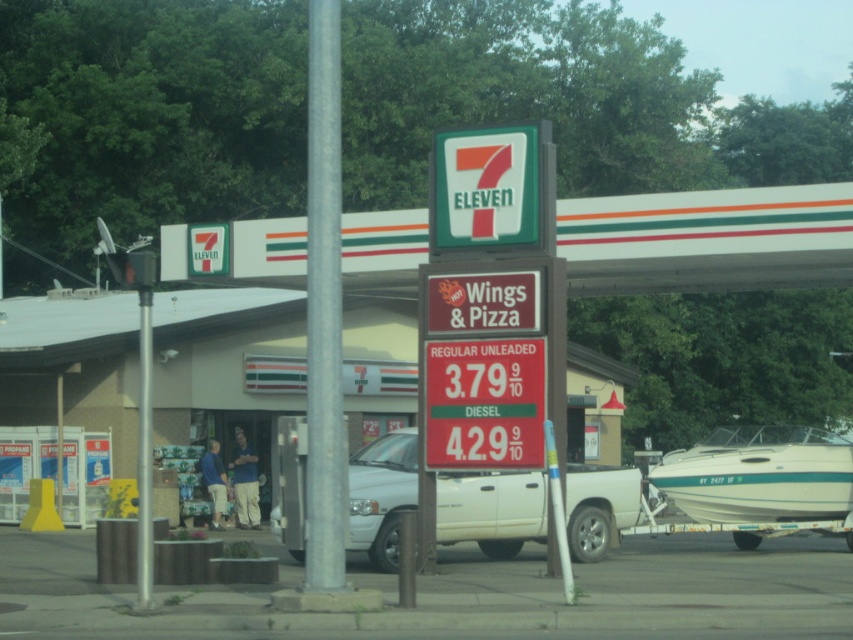
Which is below, red plastic sign at center or green plastic sign at upper center?

red plastic sign at center is lower down.

Does red plastic sign at center have a smaller size compared to green plastic sign at upper center?

Correct, red plastic sign at center occupies less space than green plastic sign at upper center.

Which is in front, point (500, 362) or point (506, 140)?

Point (500, 362)

Find the location of `red plastic sign at center`. red plastic sign at center is located at coordinates (485, 403).

Can you confirm if silver metallic pole at center is positioned to the right of white glossy boat at lower right?

In fact, silver metallic pole at center is to the left of white glossy boat at lower right.

Can you confirm if silver metallic pole at center is wider than white glossy boat at lower right?

No, silver metallic pole at center is not wider than white glossy boat at lower right.

Where is `silver metallic pole at center`? This screenshot has width=853, height=640. silver metallic pole at center is located at coordinates (323, 312).

Describe the element at coordinates (485, 403) in the screenshot. Image resolution: width=853 pixels, height=640 pixels. I see `red plastic sign at center` at that location.

Is point (442, 467) closer to camera compared to point (149, 563)?

No, (442, 467) is further to viewer.

Which is behind, point (518, 348) or point (149, 403)?

Positioned behind is point (518, 348).

In order to click on red plastic sign at center in this screenshot , I will do `click(485, 403)`.